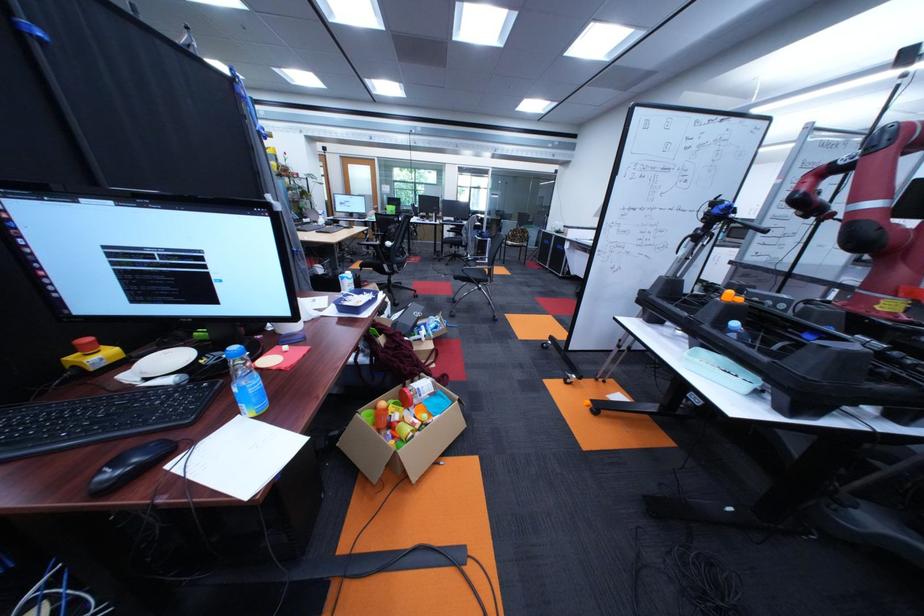
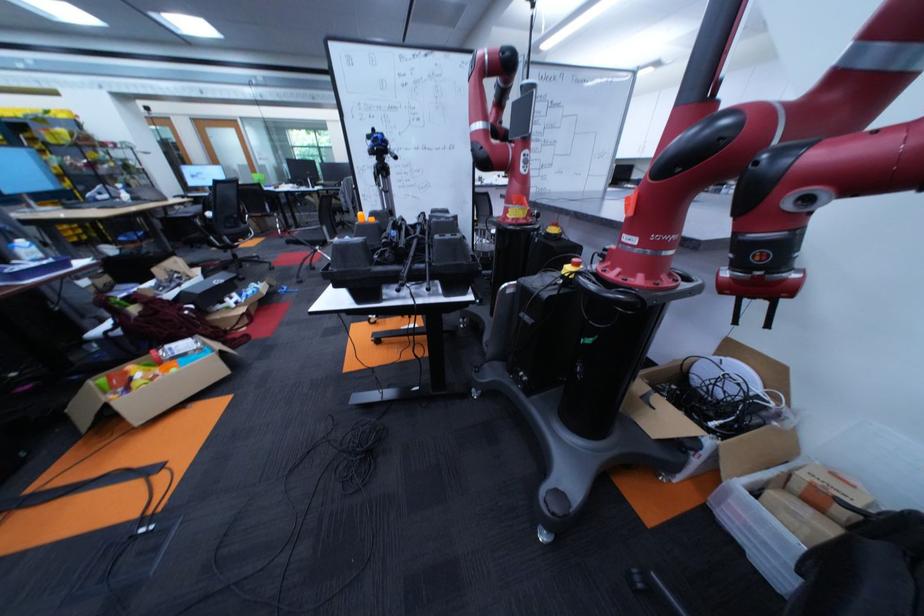
Find the pixel in the second image that matches pixel 402 245 in the first image.

(224, 215)